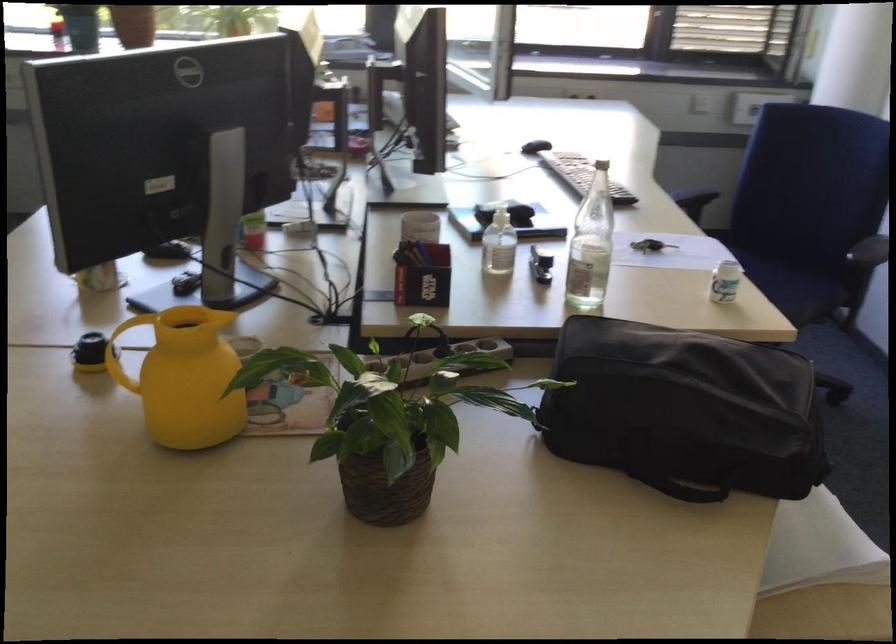
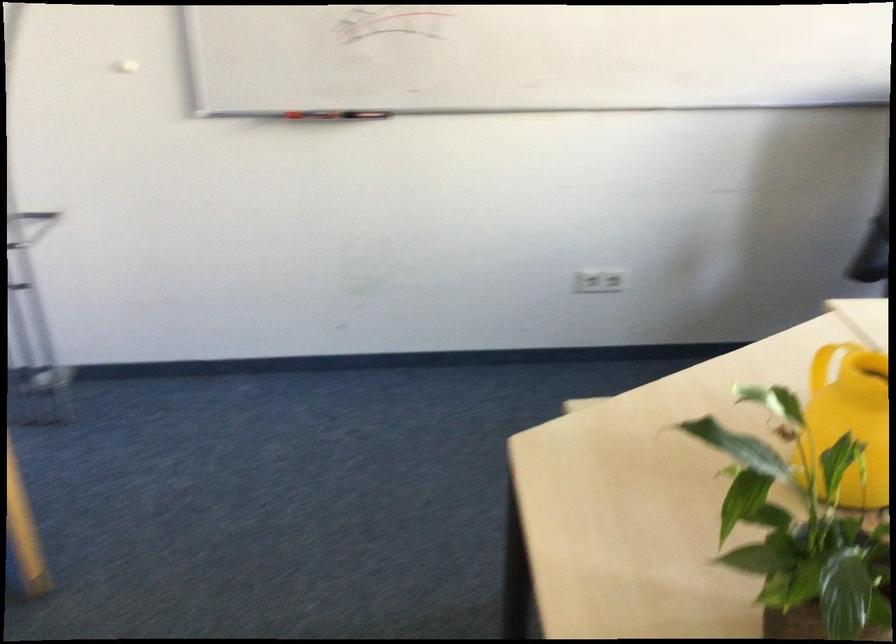
How did the camera likely rotate?

The camera rotated toward left-down.